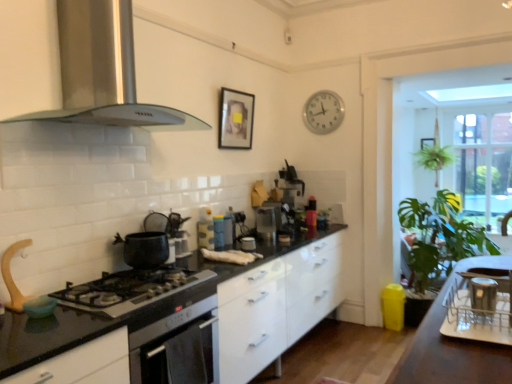
Question: Which direction should I rotate to face matte blue thermos at center, which is the 1th appliance in left-to-right order, — up or down?

Choices:
 (A) down
 (B) up

Answer: (A)

Question: Is matte black pot at stove top, which is the second kitchen appliance in top-to-bottom order, surrounded by metallic silver kettle at center, which is counted as the 3th appliance, starting from the right?

Choices:
 (A) no
 (B) yes

Answer: (A)

Question: Is metallic silver kettle at center, which ranks as the 5th appliance in front-to-back order, facing towards matte black pot at stove top, which is the second kitchen appliance in top-to-bottom order?

Choices:
 (A) no
 (B) yes

Answer: (A)

Question: Is metallic silver kettle at center, placed as the third appliance when sorted from left to right, taller than matte black pot at stove top, which is the first kitchen appliance from bottom to top?

Choices:
 (A) no
 (B) yes

Answer: (B)

Question: Considering the relative positions of metallic silver kettle at center, which is counted as the 3th appliance, starting from the right, and matte black pot at stove top, which is the first kitchen appliance from bottom to top, in the image provided, is metallic silver kettle at center, which is counted as the 3th appliance, starting from the right, to the right of matte black pot at stove top, which is the first kitchen appliance from bottom to top, from the viewer's perspective?

Choices:
 (A) no
 (B) yes

Answer: (B)

Question: Can you confirm if metallic silver kettle at center, placed as the third appliance when sorted from left to right, is wider than matte black pot at stove top, which is the first kitchen appliance from bottom to top?

Choices:
 (A) yes
 (B) no

Answer: (B)

Question: Is metallic silver kettle at center, placed as the third appliance when sorted from left to right, touching matte black pot at stove top, which is the first kitchen appliance from bottom to top?

Choices:
 (A) yes
 (B) no

Answer: (B)

Question: Is matte black kettle at center, positioned as the third appliance in front-to-back order, aimed at green leafy plant at right?

Choices:
 (A) yes
 (B) no

Answer: (B)

Question: Is matte black kettle at center, the second appliance in the left-to-right sequence, wider than green leafy plant at right?

Choices:
 (A) yes
 (B) no

Answer: (B)

Question: Considering the relative positions of matte black kettle at center, positioned as the 4th appliance in right-to-left order, and green leafy plant at right in the image provided, is matte black kettle at center, positioned as the 4th appliance in right-to-left order, to the right of green leafy plant at right from the viewer's perspective?

Choices:
 (A) no
 (B) yes

Answer: (A)

Question: Does matte black kettle at center, positioned as the 4th appliance in right-to-left order, contain green leafy plant at right?

Choices:
 (A) no
 (B) yes

Answer: (A)

Question: Is matte black kettle at center, which is the 3th appliance in back-to-front order, placed right next to green leafy plant at right?

Choices:
 (A) yes
 (B) no

Answer: (B)

Question: Does matte black kettle at center, positioned as the third appliance in front-to-back order, have a lesser width compared to green leafy plant at right?

Choices:
 (A) no
 (B) yes

Answer: (B)

Question: Can you confirm if silver metallic clock at upper center is positioned to the left of stainless steel range hood at upper left, which is the second kitchen appliance in bottom-to-top order?

Choices:
 (A) yes
 (B) no

Answer: (B)